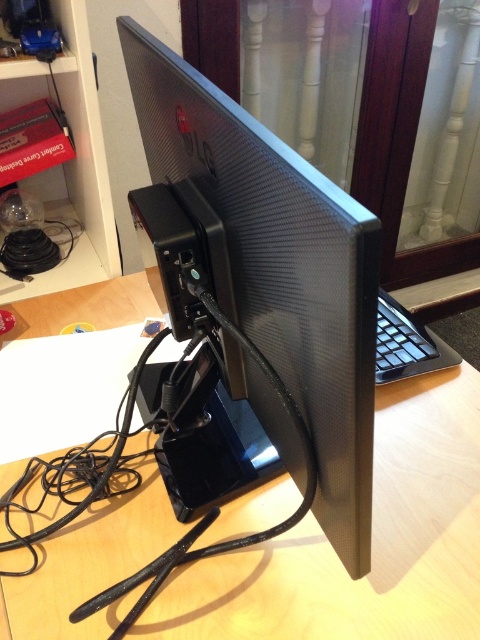
Can you confirm if wooden computer desk at center is positioned to the left of satin black monitor at center?

Yes, wooden computer desk at center is to the left of satin black monitor at center.

Who is higher up, wooden computer desk at center or satin black monitor at center?

satin black monitor at center is higher up.

Between point (232, 532) and point (372, 419), which one is positioned in front?

Point (372, 419)

Find the location of a particular element. The image size is (480, 640). wooden computer desk at center is located at coordinates (372, 545).